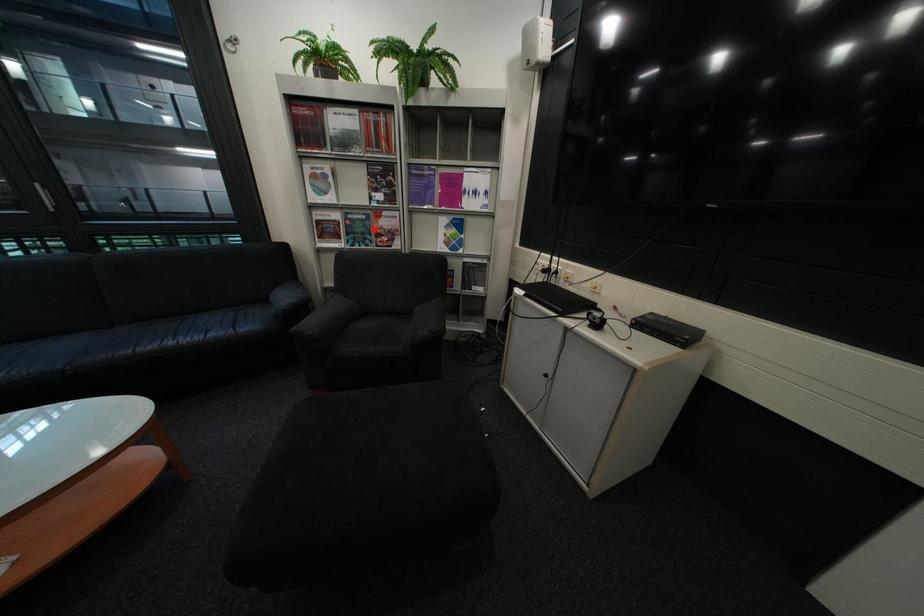
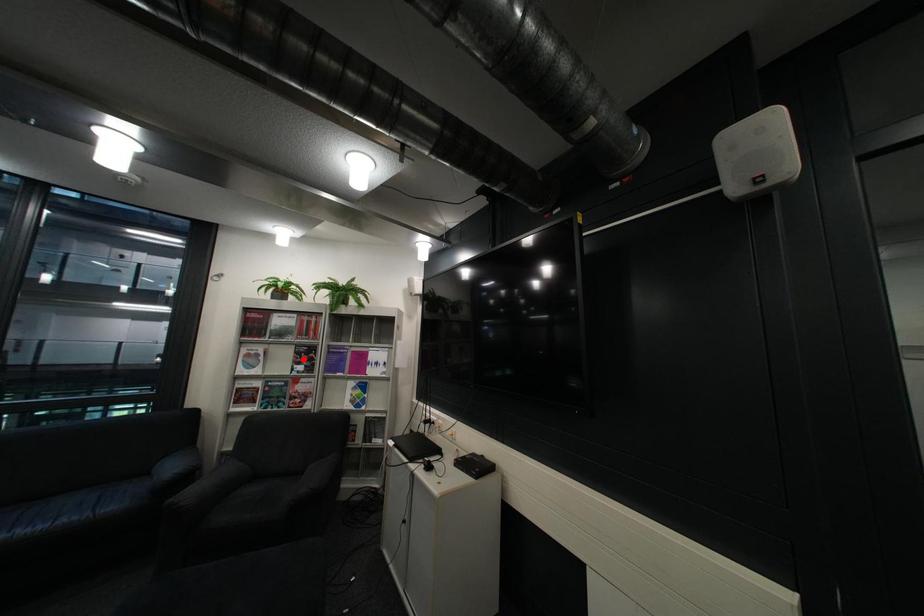
Looking at this image, I am providing you with two images of the same scene from different viewpoints. A red point is marked on the first image and another point is marked on the second image. Is the marked point in image1 the same physical position as the marked point in image2?

No